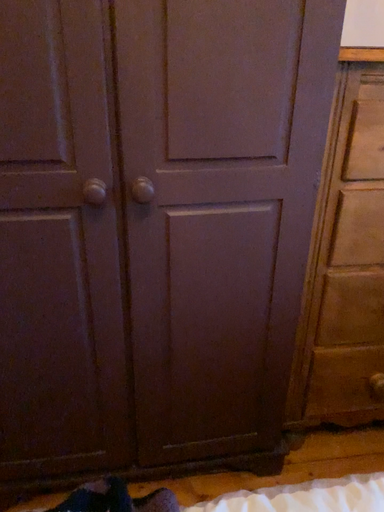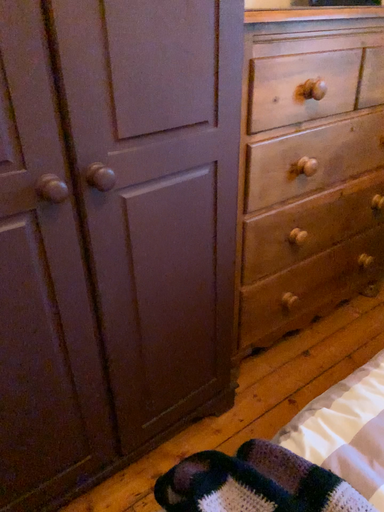
Question: Which way did the camera rotate in the video?

Choices:
 (A) rotated right
 (B) rotated left

Answer: (A)